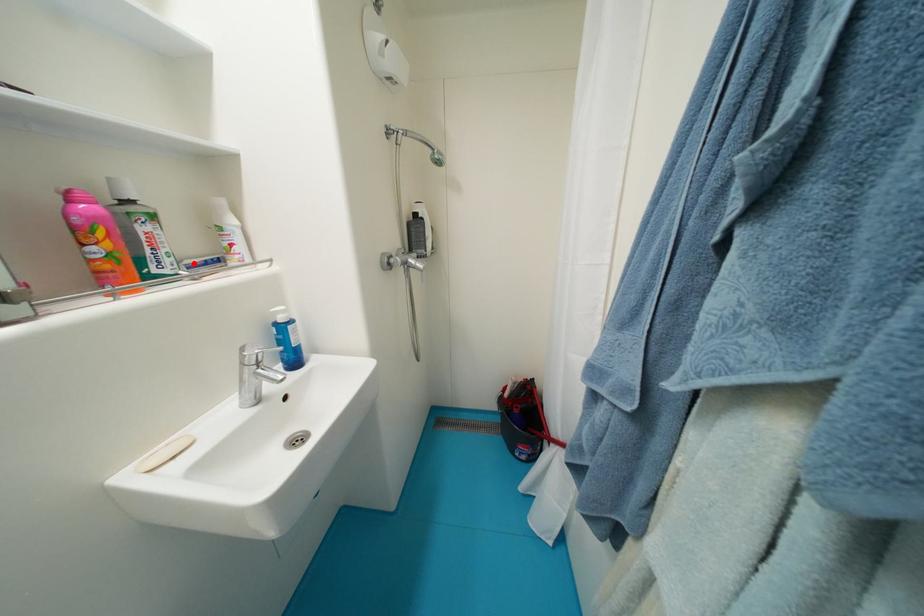
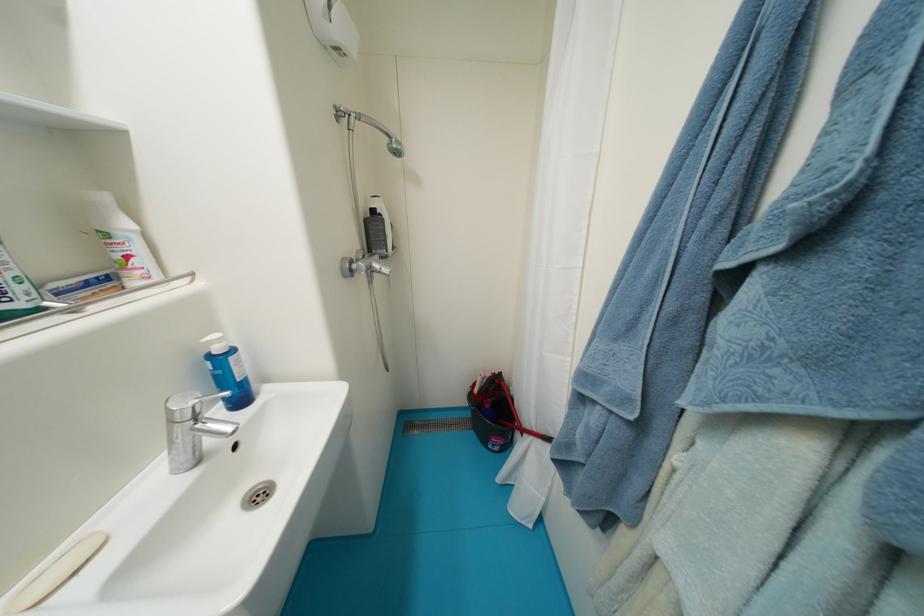
Question: I am providing you with two images of the same scene from different viewpoints. A red point is marked on the first image. Can you still see the location of the red point in image 2?

Choices:
 (A) Yes
 (B) No

Answer: (A)